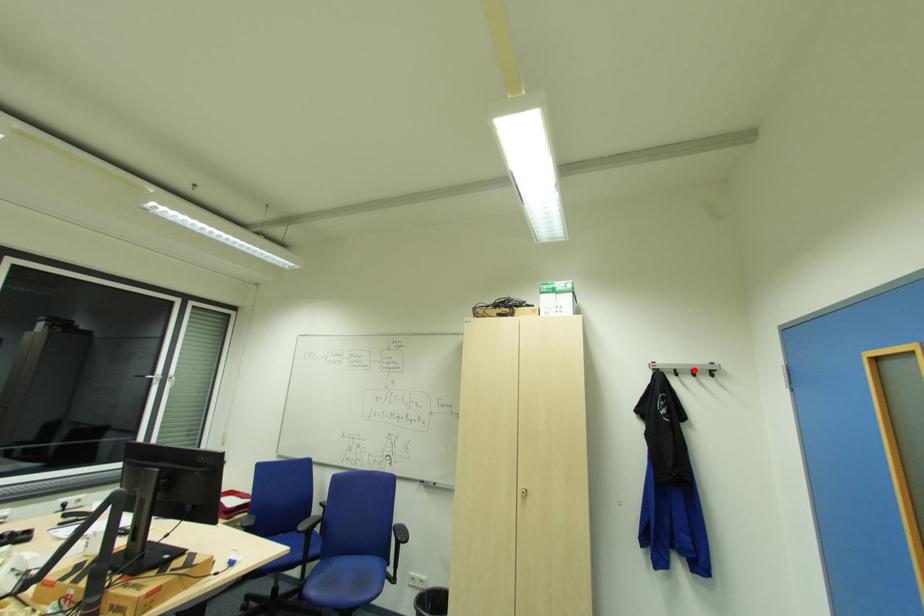
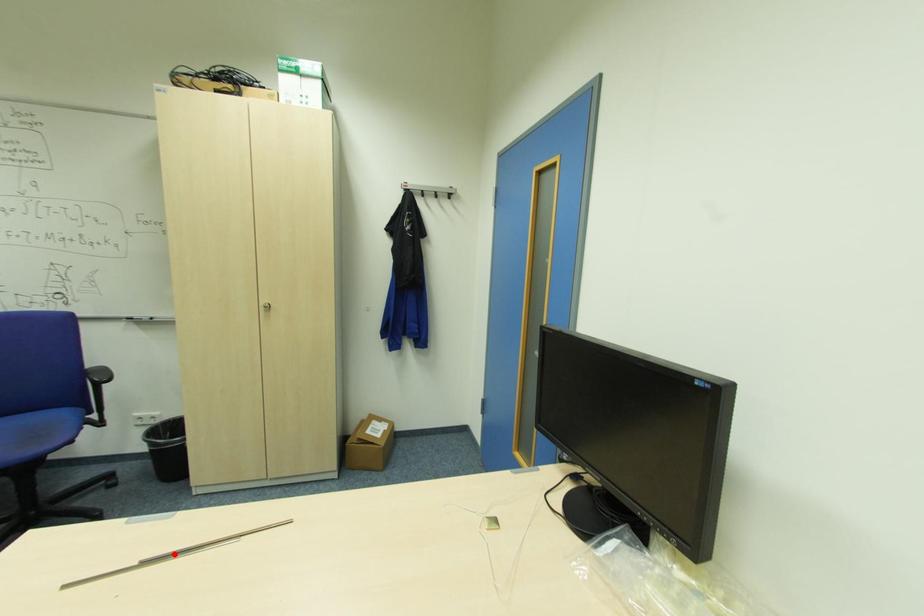
I am providing you with two images of the same scene from different viewpoints. A red point is marked on the first image and another point is marked on the second image. Are the points marked in image1 and image2 representing the same 3D position?

No